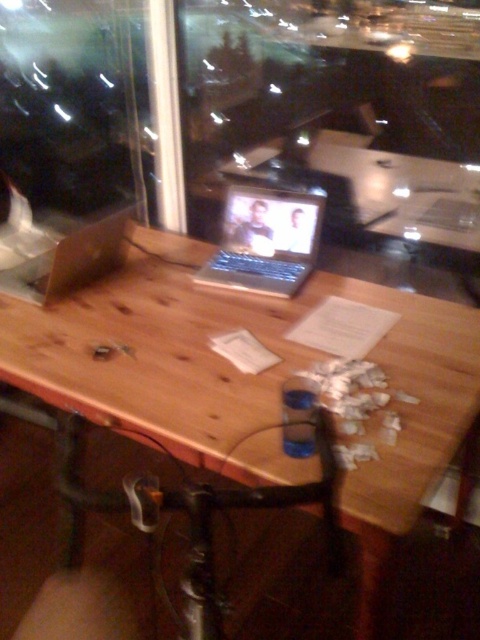
You are setting up a video call and need to position two laptops on the table. The scene shows a silver metallic laptop at center and a matte brown laptop at center. Which laptop should you move forward to ensure the camera is facing you directly?

The matte brown laptop at center is behind the silver metallic laptop at center. To ensure the camera is facing you directly, move the matte brown laptop at center forward so it is in front of the silver metallic laptop at center.